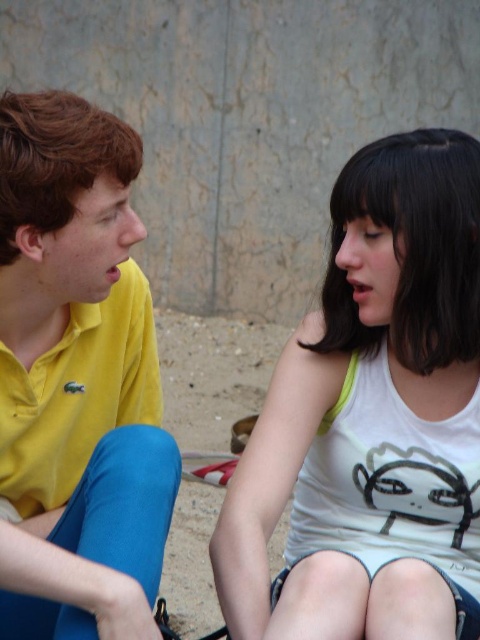
You are designing a clothing catalog and need to place the white cotton tank top at center and the yellow matte polo shirt at left in a layout. Which clothing item should you allocate more space to in the catalog layout?

The white cotton tank top at center has a larger size compared to the yellow matte polo shirt at left, so you should allocate more space to the white cotton tank top at center in the catalog layout.

You are standing at the camera position and want to hand a gift to the person wearing the white cotton tank top at center. The gift is 2 feet long. Can you reach them without moving from your current position?

The distance between you and the white cotton tank top at center is 5.05 feet. Since the gift is 2 feet long, you can extend your arm to reach them without moving.